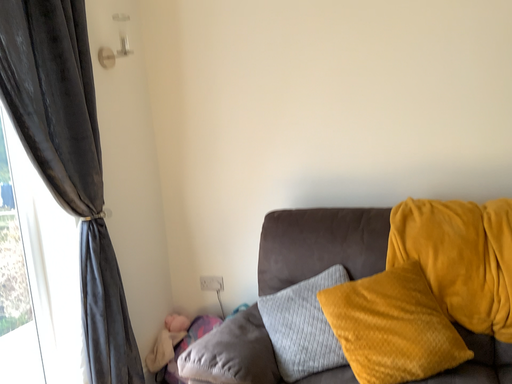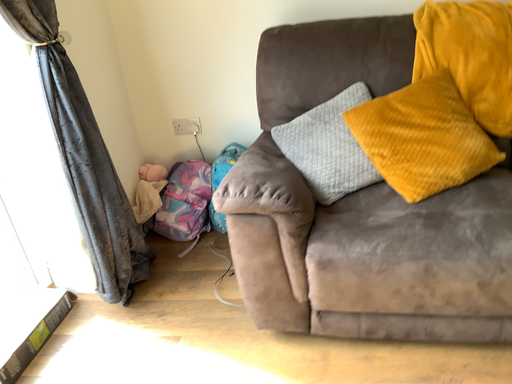
Question: How did the camera likely rotate when shooting the video?

Choices:
 (A) rotated right
 (B) rotated left

Answer: (A)